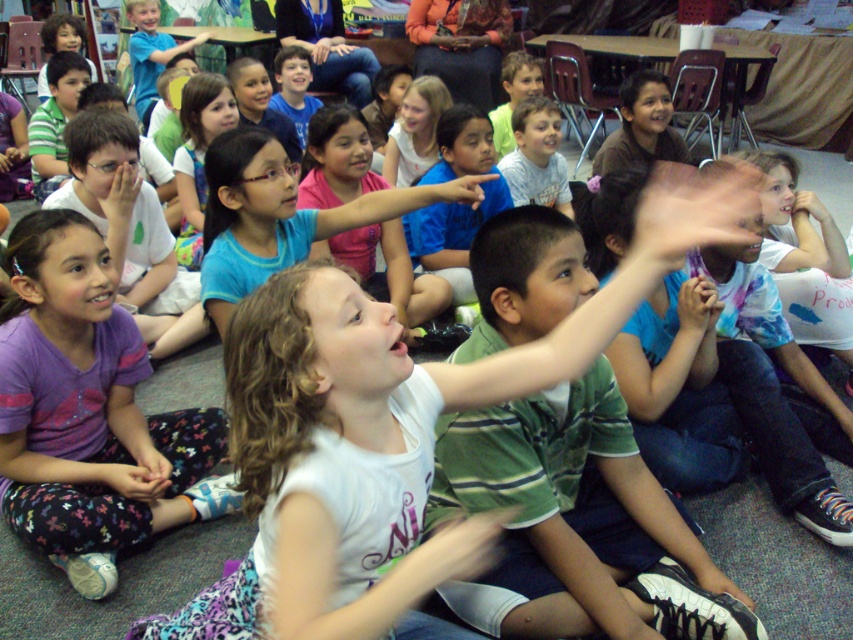
You are standing in the classroom and want to reach a point marked at coordinates point (560, 168). If you can walk 4 meters in 1 minute, how long will it take you to reach that point?

The distance of point (560, 168) from viewer is 3.88 meters. Since you can walk 4 meters in 1 minute, it will take approximately 58 seconds to reach the point.

In the classroom scene, you see a child wearing a purple cotton shirt at lower left and another wearing dark purple fabric at lower left. Which child is positioned higher up in the image?

The purple cotton shirt at lower left is much taller than the dark purple fabric at lower left, so the child wearing the purple cotton shirt at lower left is positioned higher up in the image.